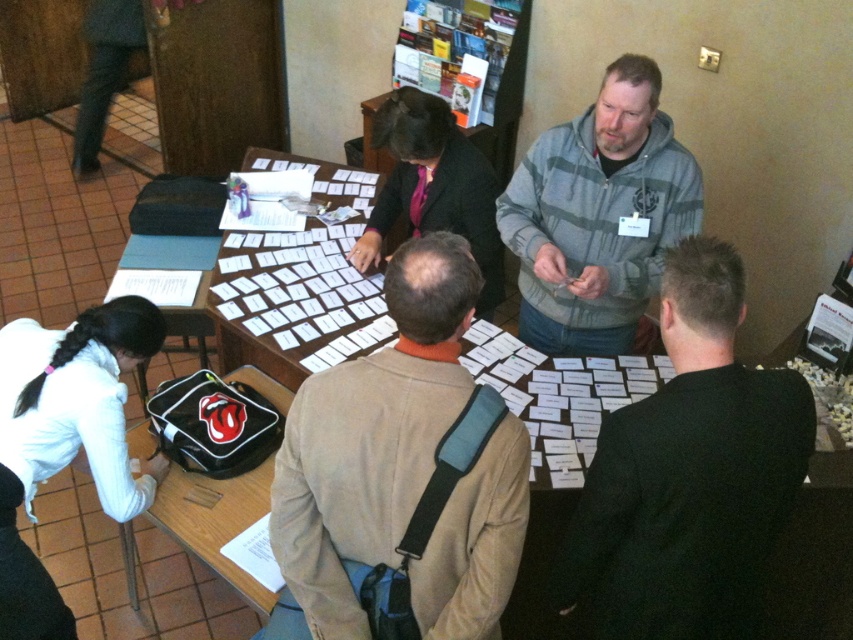
Question: Is beige sweater at center smaller than white fabric at lower left?

Choices:
 (A) yes
 (B) no

Answer: (A)

Question: Which object appears farthest from the camera in this image?

Choices:
 (A) wooden table at center
 (B) white fabric at lower left
 (C) black smooth jacket at center

Answer: (A)

Question: Which point appears closest to the camera in this image?

Choices:
 (A) (351, 554)
 (B) (645, 300)
 (C) (560, 586)

Answer: (A)

Question: Does black smooth jacket at center appear on the left side of wooden table at center?

Choices:
 (A) yes
 (B) no

Answer: (B)

Question: Does beige sweater at center have a greater width compared to dark gray hoodie at center?

Choices:
 (A) no
 (B) yes

Answer: (A)

Question: Considering the real-world distances, which object is farthest from the black smooth jacket at center?

Choices:
 (A) beige sweater at center
 (B) gray striped hoodie at upper right
 (C) white fabric at lower left

Answer: (C)